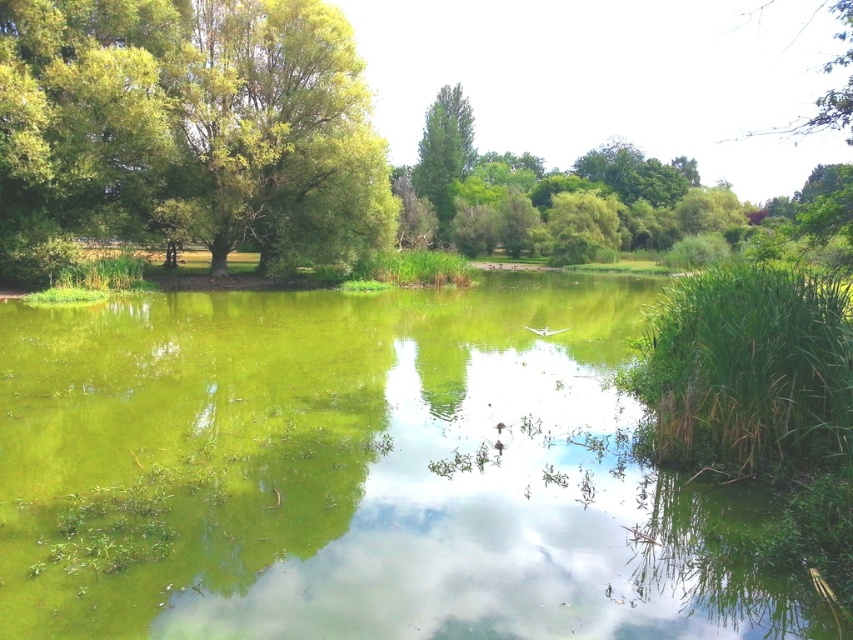
Between green algae-covered water at center and green leafy tree at upper right, which one is positioned higher?

green leafy tree at upper right

Where is `green algae-covered water at center`? The height and width of the screenshot is (640, 853). green algae-covered water at center is located at coordinates (355, 472).

Which is in front, point (41, 627) or point (819, 131)?

Point (41, 627)

Where is `green algae-covered water at center`? The image size is (853, 640). green algae-covered water at center is located at coordinates (355, 472).

Who is positioned more to the left, green leafy tree at left or green leafy tree at upper right?

From the viewer's perspective, green leafy tree at left appears more on the left side.

Looking at this image, does green leafy tree at left have a lesser width compared to green leafy tree at upper right?

Correct, green leafy tree at left's width is less than green leafy tree at upper right's.

What do you see at coordinates (187, 129) in the screenshot?
I see `green leafy tree at left` at bounding box center [187, 129].

This screenshot has height=640, width=853. In order to click on green leafy tree at left in this screenshot , I will do `click(187, 129)`.

Can you confirm if green algae-covered water at center is positioned to the left of green leafy tree at left?

In fact, green algae-covered water at center is to the right of green leafy tree at left.

Between point (573, 340) and point (184, 84), which one is positioned in front?

Point (573, 340)

What are the coordinates of `green algae-covered water at center` in the screenshot? It's located at (355, 472).